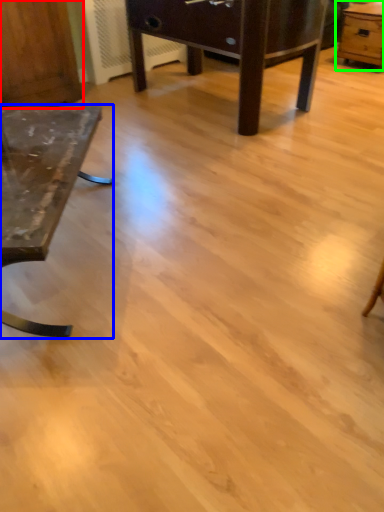
Question: Estimate the real-world distances between objects in this image. Which object is closer to dresser (highlighted by a red box), table (highlighted by a blue box) or table (highlighted by a green box)?

Choices:
 (A) table
 (B) table

Answer: (A)